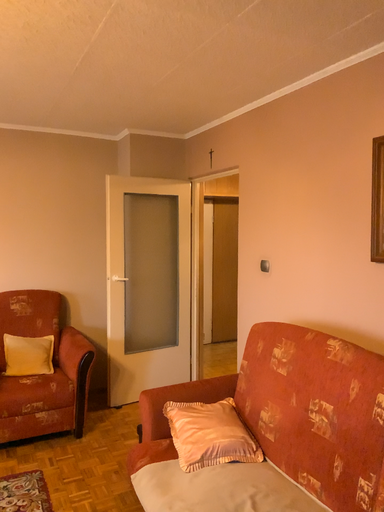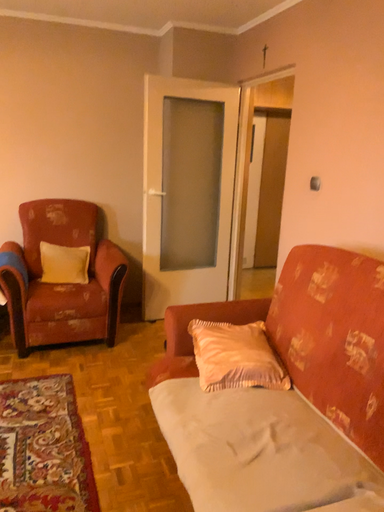
Question: Which way did the camera rotate in the video?

Choices:
 (A) rotated upward
 (B) rotated downward

Answer: (B)